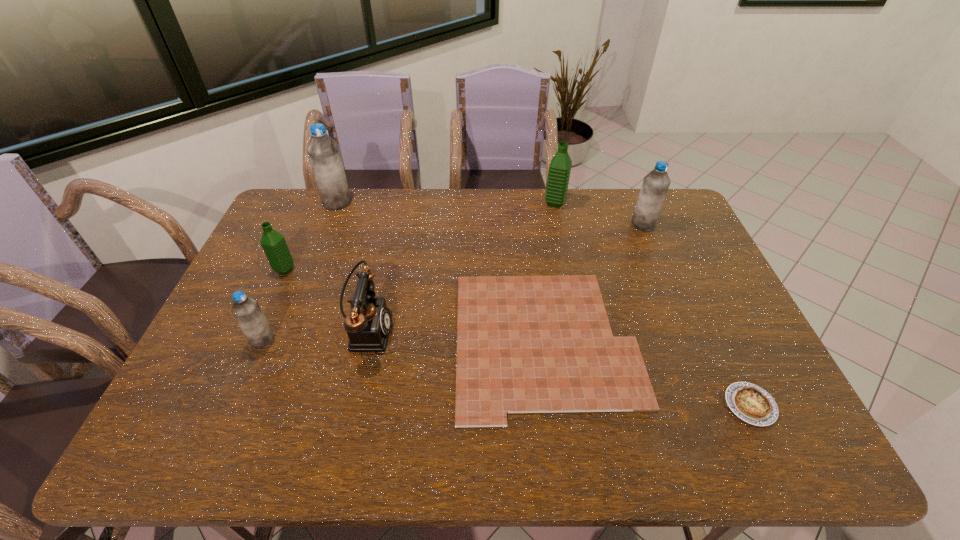
This screenshot has height=540, width=960. Identify the location of free area in between the second smallest blue water bottle and the biggest blue water bottle. pyautogui.click(x=491, y=213).

What are the coordinates of `vacant area between the tallest object and the fourth object from left to right` in the screenshot? It's located at click(x=352, y=266).

Find the location of a particular element. The width and height of the screenshot is (960, 540). the seventh closest object relative to the farthest blue water bottle is located at coordinates (751, 403).

Identify which object is the sixth nearest to the second water bottle from right to left. Please provide its 2D coordinates. Your answer should be formatted as a tuple, i.e. [(x, y)], where the tuple contains the x and y coordinates of a point satisfying the conditions above.

[(274, 245)]

Identify which water bottle is located as the nearest to the rightmost water bottle. Please provide its 2D coordinates. Your answer should be formatted as a tuple, i.e. [(x, y)], where the tuple contains the x and y coordinates of a point satisfying the conditions above.

[(560, 166)]

Identify which water bottle is the nearest to the right green water bottle. Please provide its 2D coordinates. Your answer should be formatted as a tuple, i.e. [(x, y)], where the tuple contains the x and y coordinates of a point satisfying the conditions above.

[(656, 183)]

The width and height of the screenshot is (960, 540). I want to click on blue water bottle that can be found as the second closest to the second biggest blue water bottle, so click(246, 310).

Choose which blue water bottle is the nearest neighbor to the gameboard. Please provide its 2D coordinates. Your answer should be formatted as a tuple, i.e. [(x, y)], where the tuple contains the x and y coordinates of a point satisfying the conditions above.

[(656, 183)]

Where is `vacant point that satisfies the following two spatial constraints: 1. on the front side of the biggest blue water bottle; 2. on the left side of the gameboard`? The width and height of the screenshot is (960, 540). vacant point that satisfies the following two spatial constraints: 1. on the front side of the biggest blue water bottle; 2. on the left side of the gameboard is located at coordinates (283, 341).

Image resolution: width=960 pixels, height=540 pixels. I want to click on free region that satisfies the following two spatial constraints: 1. on the front side of the second smallest blue water bottle; 2. on the front of the telephone at the rotary dial, so click(687, 329).